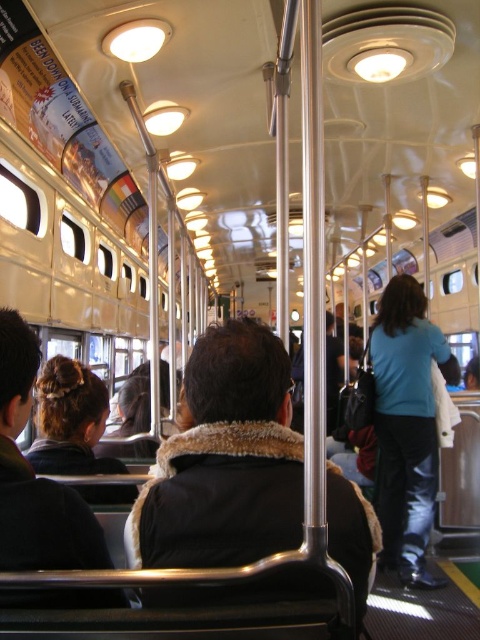
Between dark brown fur-lined coat at center and blue fabric jacket at center, which one has more height?

blue fabric jacket at center

How much distance is there between dark brown fur-lined coat at center and blue fabric jacket at center?

The distance of dark brown fur-lined coat at center from blue fabric jacket at center is 2.36 meters.

Does point (301, 481) lie in front of point (407, 317)?

Yes, point (301, 481) is closer to viewer.

You are a GUI agent. You are given a task and a screenshot of the screen. Output one action in this format:
    pyautogui.click(x=<x>, y=<y>)
    Task: Click on the dark brown fur-lined coat at center
    This screenshot has height=640, width=480.
    Given the screenshot: What is the action you would take?
    pyautogui.click(x=225, y=460)